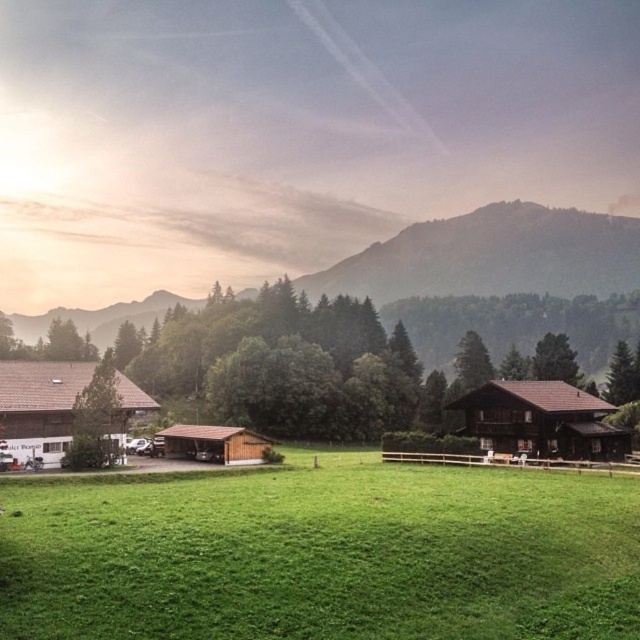
Identify the location of green grassy field at center. Image resolution: width=640 pixels, height=640 pixels. (321, 554).

Between green grassy field at center and brown wooden hut at center, which one appears on the right side from the viewer's perspective?

From the viewer's perspective, green grassy field at center appears more on the right side.

Identify the location of green grassy field at center. (321, 554).

Where is `green grassy field at center`? This screenshot has width=640, height=640. green grassy field at center is located at coordinates 321,554.

Does brown wooden house at center-right lie in front of brown wooden hut at lower left?

No.

Can you confirm if brown wooden house at center-right is positioned to the left of brown wooden hut at lower left?

In fact, brown wooden house at center-right is to the right of brown wooden hut at lower left.

Locate an element on the screen. This screenshot has height=640, width=640. brown wooden house at center-right is located at coordinates (541, 420).

Which is in front, point (576, 410) or point (198, 424)?

Positioned in front is point (576, 410).

Is brown wooden house at center-right taller than brown wooden hut at center?

Indeed, brown wooden house at center-right has a greater height compared to brown wooden hut at center.

Measure the distance between point [513,424] and camera.

Point [513,424] and camera are 70.42 meters apart.

Find the location of a particular element. brown wooden house at center-right is located at coordinates (541, 420).